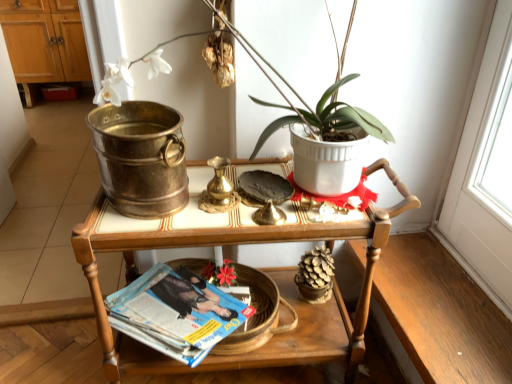
Where is `empty space that is ontop of blue glossy magazine at lower center (from a real-world perspective)`? The image size is (512, 384). empty space that is ontop of blue glossy magazine at lower center (from a real-world perspective) is located at coordinates (188, 295).